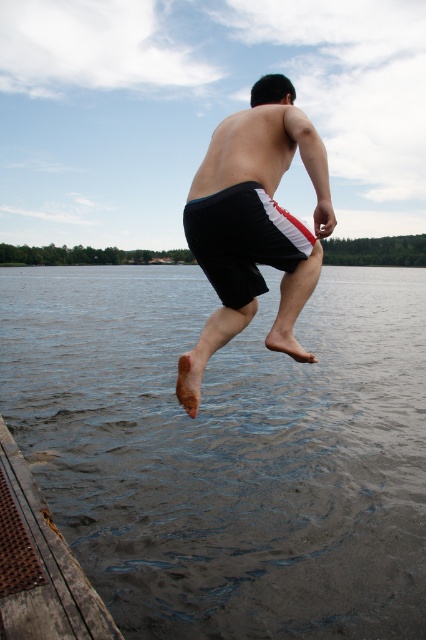
From the picture: You are a photographer trying to capture the perfect shot of the person jumping into the water. Based on the scene, which object in the image is larger in size between the dark gray water at lower center and the black fabric shorts at center?

The dark gray water at lower center is larger than the black fabric shorts at center, so the water would appear bigger in the photograph.